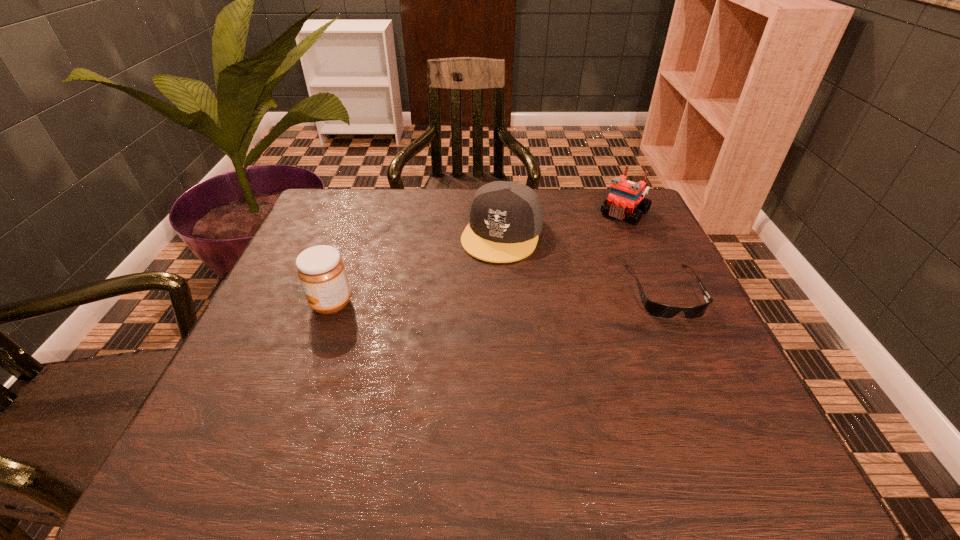
Image resolution: width=960 pixels, height=540 pixels. Find the location of `jam`. jam is located at coordinates (321, 271).

Locate an element on the screen. the shortest object is located at coordinates (658, 310).

The image size is (960, 540). In order to click on the third object from right to left in this screenshot , I will do `click(505, 218)`.

Where is `Lego`? Lego is located at coordinates (624, 195).

Locate an element on the screen. vacant space located 0.200m on the front-facing side of the sunglasses is located at coordinates (718, 406).

Where is `free region located 0.150m on the front-facing side of the third object from right to left`? The image size is (960, 540). free region located 0.150m on the front-facing side of the third object from right to left is located at coordinates (471, 305).

I want to click on free point located on the front-facing side of the third object from right to left, so click(455, 339).

Where is `vacant area located 0.250m on the front-facing side of the third object from right to left`? The image size is (960, 540). vacant area located 0.250m on the front-facing side of the third object from right to left is located at coordinates (455, 339).

Locate an element on the screen. This screenshot has width=960, height=540. free space located 0.340m on the front-facing side of the Lego is located at coordinates (550, 295).

This screenshot has width=960, height=540. Identify the location of free space located 0.060m on the front-facing side of the Lego. (604, 235).